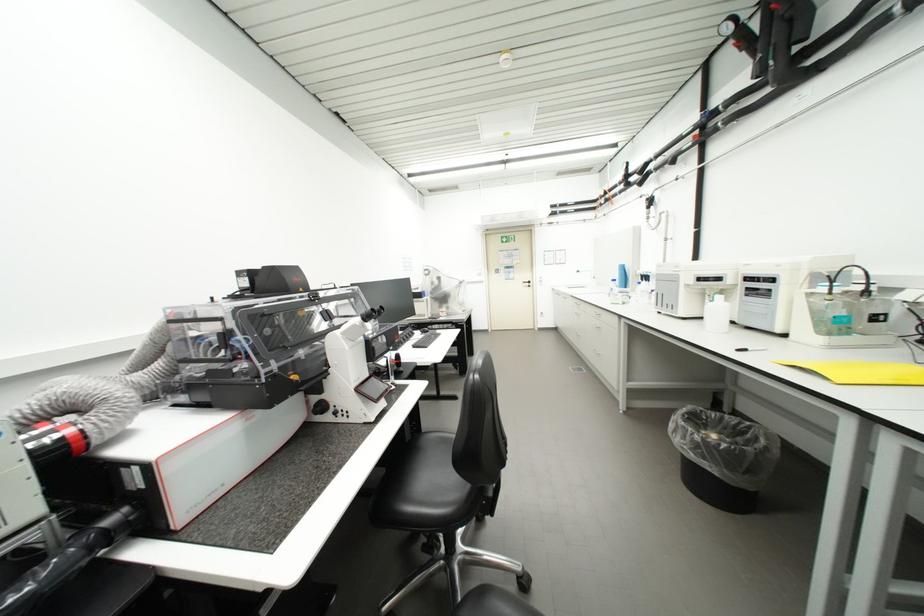
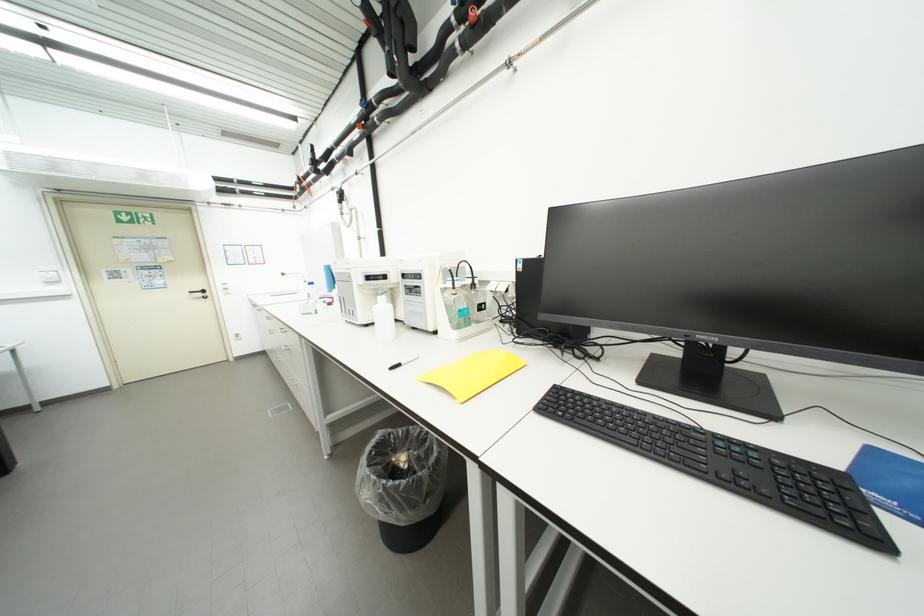
Question: Based on the continuous images, in which direction is the camera rotating? Reply with the corresponding letter.

Choices:
 (A) Left
 (B) Right
 (C) Up
 (D) Down

Answer: (B)